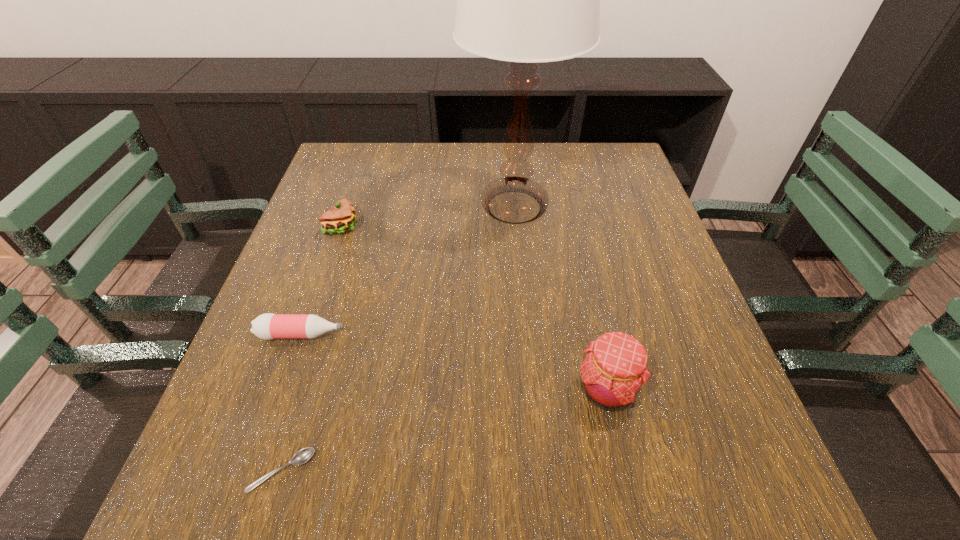
Identify the location of table lamp. The width and height of the screenshot is (960, 540). (526, 0).

This screenshot has height=540, width=960. What are the coordinates of `jam` in the screenshot? It's located at (615, 368).

Identify the location of the second tallest object. The width and height of the screenshot is (960, 540). (615, 368).

You are a GUI agent. You are given a task and a screenshot of the screen. Output one action in this format:
    pyautogui.click(x=<x>, y=<y>)
    Task: Click on the sandwich
    This screenshot has width=960, height=540.
    Given the screenshot: What is the action you would take?
    pyautogui.click(x=339, y=219)

Locate an element on the screen. This screenshot has height=540, width=960. the second shortest object is located at coordinates pyautogui.click(x=267, y=326).

The width and height of the screenshot is (960, 540). What are the coordinates of `the third nearest object` in the screenshot? It's located at (267, 326).

Find the location of a particular element. The image size is (960, 540). soupspoon is located at coordinates (302, 456).

The image size is (960, 540). I want to click on the shortest object, so click(x=302, y=456).

You are a GUI agent. You are given a task and a screenshot of the screen. Output one action in this format:
    pyautogui.click(x=<x>, y=<y>)
    Task: Click on the vacant space located 0.280m on the front-facing side of the table lamp
    This screenshot has width=960, height=540.
    Given the screenshot: What is the action you would take?
    pyautogui.click(x=527, y=345)

Find the location of a particular element. The height and width of the screenshot is (540, 960). vacant space situated 0.370m on the left of the jam is located at coordinates (355, 390).